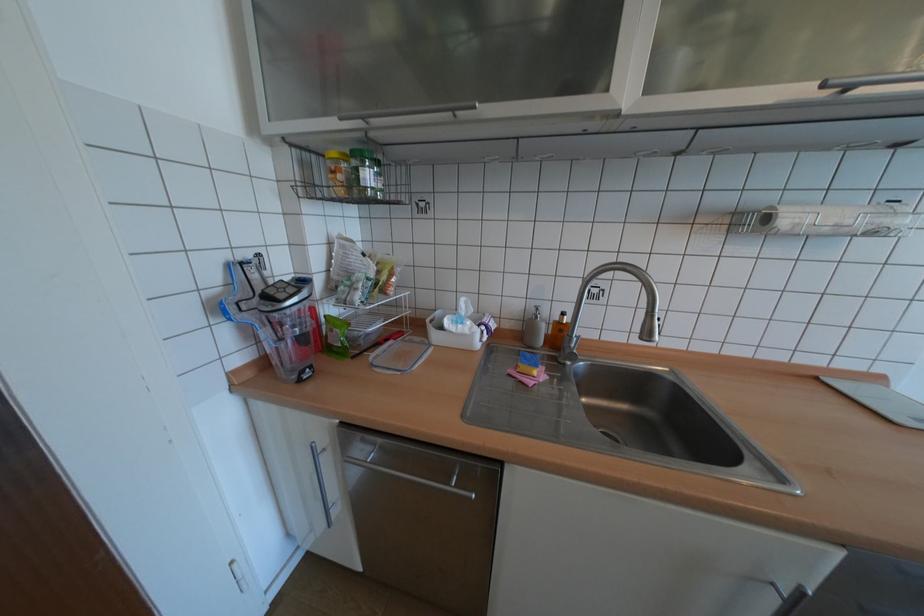
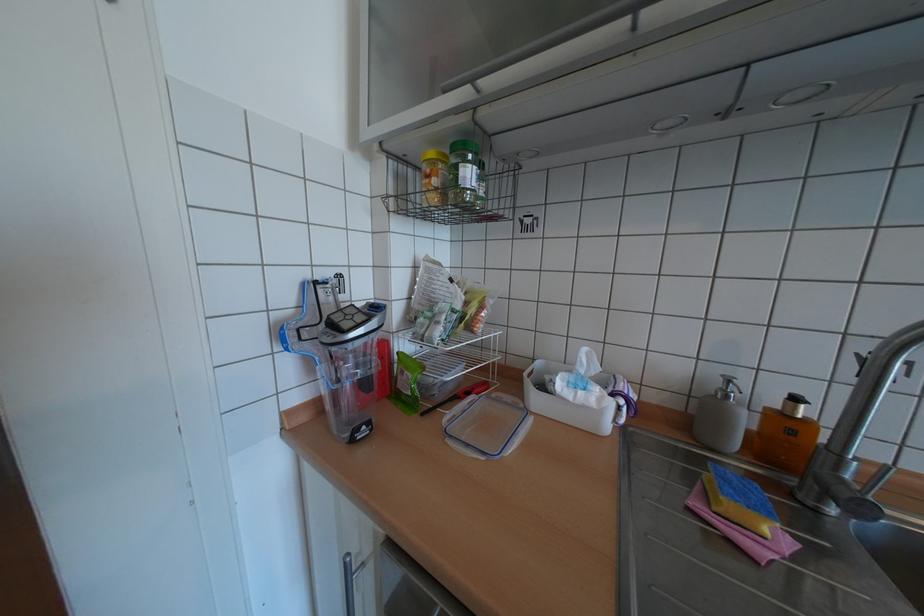
Where in the second image is the point corresponding to point 527,371 from the first image?

(723, 508)